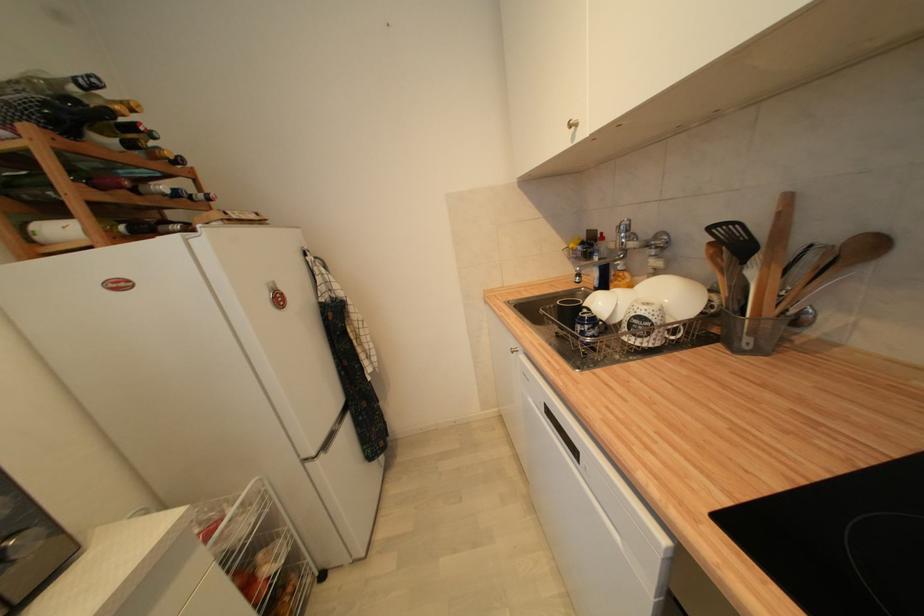
I want to click on refrigerator handle, so click(x=341, y=438).